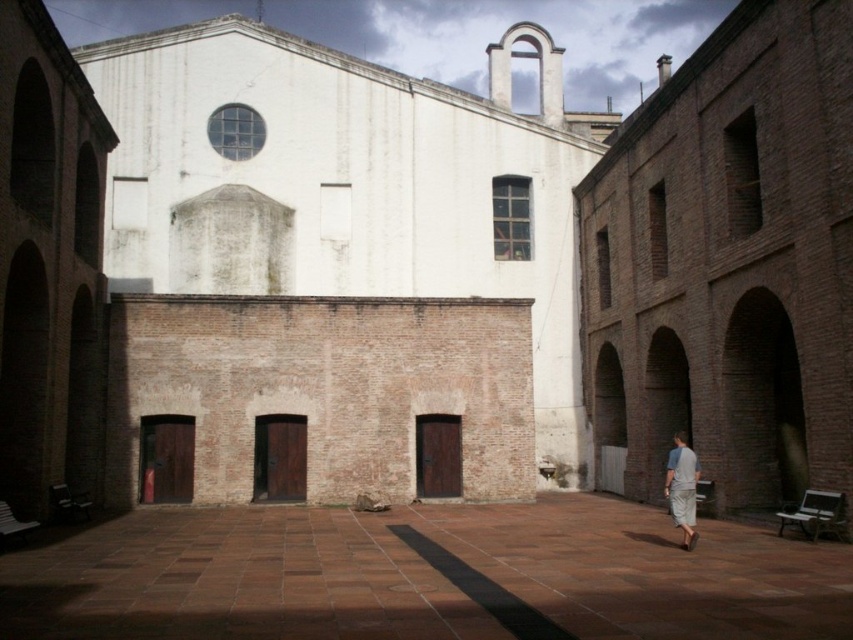
Is brown stone courtyard at center positioned before gray cotton shirt at lower right?

Yes, brown stone courtyard at center is closer to the viewer.

Is brown stone courtyard at center shorter than gray cotton shirt at lower right?

Indeed, brown stone courtyard at center has a lesser height compared to gray cotton shirt at lower right.

Does point (842, 570) come closer to viewer compared to point (682, 499)?

Yes, it is.

Find the location of `brown stone courtyard at center`. brown stone courtyard at center is located at coordinates (424, 577).

Does brown brick church at right lie in front of gray cotton shirt at lower right?

No, it is behind gray cotton shirt at lower right.

Is brown brick church at right smaller than gray cotton shirt at lower right?

Incorrect, brown brick church at right is not smaller in size than gray cotton shirt at lower right.

Which is behind, point (740, 477) or point (674, 490)?

The point (740, 477) is behind.

This screenshot has height=640, width=853. Find the location of `brown brick church at right`. brown brick church at right is located at coordinates [x=729, y=262].

Is point (840, 19) farther from viewer compared to point (704, 593)?

That is True.

In the scene shown: Does brown brick church at right have a greater height compared to brown stone courtyard at center?

Yes.

The width and height of the screenshot is (853, 640). What do you see at coordinates (729, 262) in the screenshot?
I see `brown brick church at right` at bounding box center [729, 262].

Where is `brown brick church at right`? brown brick church at right is located at coordinates (729, 262).